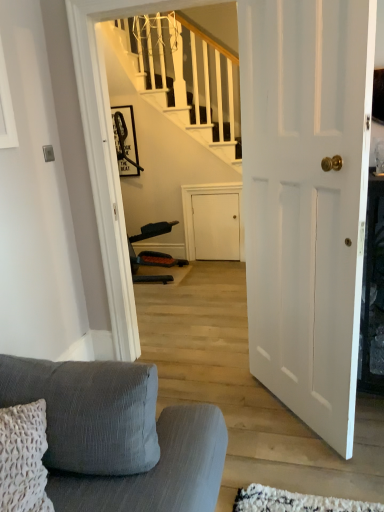
I want to click on free area below white matte door at center (from a real-world perspective), so click(x=285, y=409).